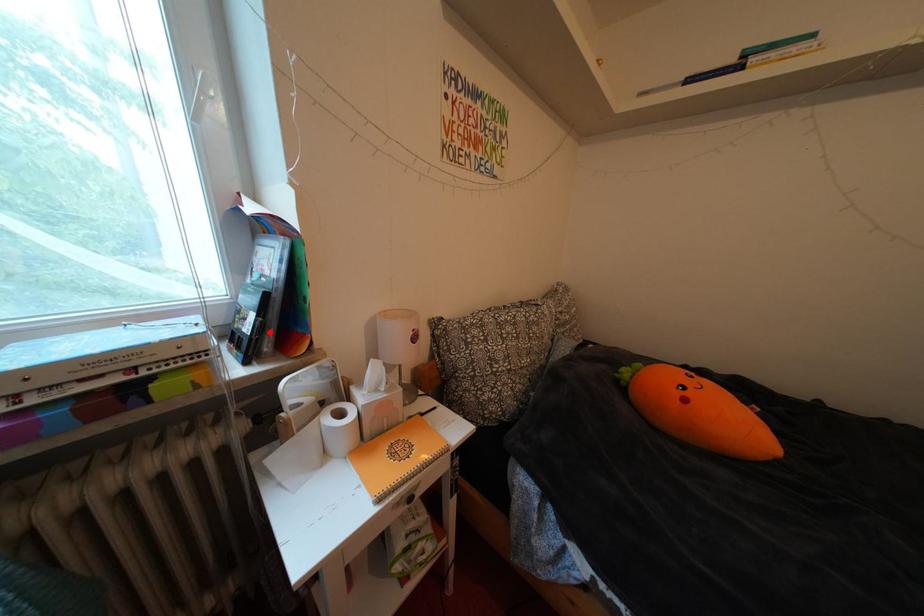
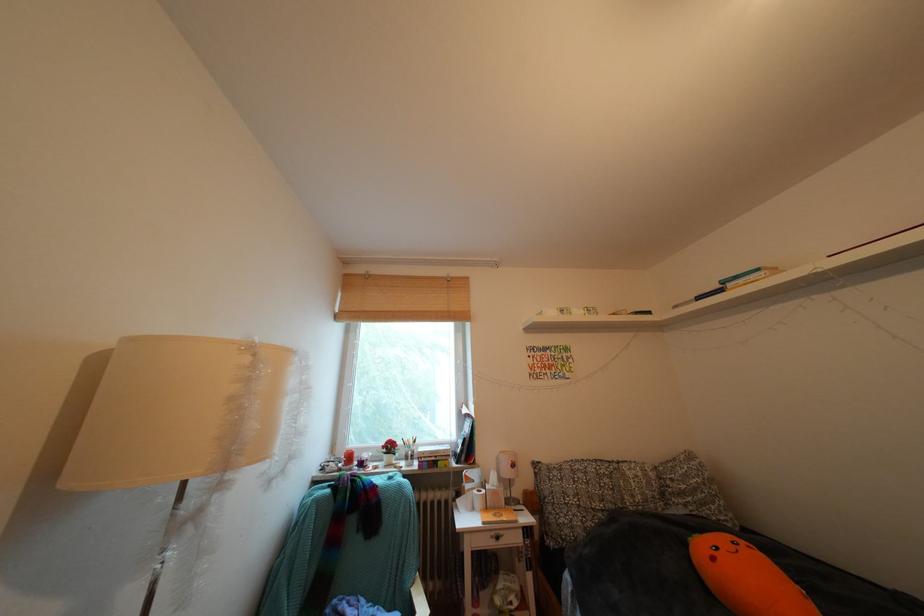
Question: I am providing you with two images of the same scene from different viewpoints. Given a red point in image1, look at the same physical point in image2. Is it:

Choices:
 (A) Closer to the viewpoint
 (B) Farther from the viewpoint

Answer: (B)